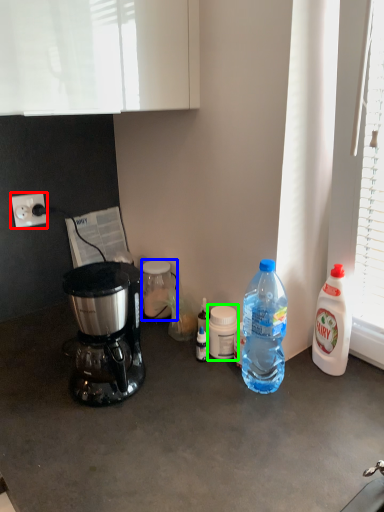
Question: Which object is positioned farthest from power outlet (highlighted by a red box)? Select from bottle (highlighted by a blue box) and bottle (highlighted by a green box).

Choices:
 (A) bottle
 (B) bottle

Answer: (B)